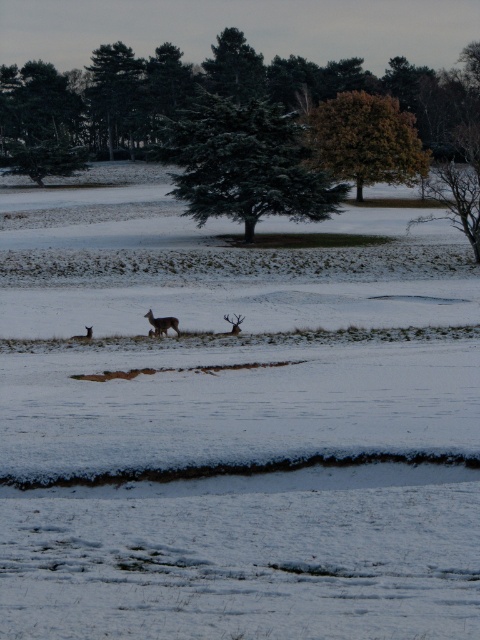
At what (x,y) coordinates should I click in order to perform the action: click on brown matte/deer at center. Please return your answer as a coordinate pair (x, y). Looking at the image, I should click on (233, 323).

Can you confirm if brown matte/deer at center is shorter than brown matte/deer at lower left?

No.

Describe the element at coordinates (233, 323) in the screenshot. I see `brown matte/deer at center` at that location.

This screenshot has width=480, height=640. I want to click on brown matte/deer at center, so click(x=233, y=323).

Does green matte tree at upper center have a greater height compared to brown matte/deer at lower left?

Yes.

Can you confirm if green matte tree at upper center is bigger than brown matte/deer at lower left?

Yes.

Is point (101, 115) closer to viewer compared to point (72, 337)?

That is False.

The image size is (480, 640). What are the coordinates of `green matte tree at upper center` in the screenshot? It's located at (118, 92).

Does point (298, 182) come closer to viewer compared to point (84, 337)?

No, it is behind (84, 337).

Does green matte tree at center have a smaller size compared to brown matte/deer at lower left?

Incorrect, green matte tree at center is not smaller in size than brown matte/deer at lower left.

Identify the location of green matte tree at center. (243, 163).

Where is `green matte tree at center`? Image resolution: width=480 pixels, height=640 pixels. green matte tree at center is located at coordinates (243, 163).